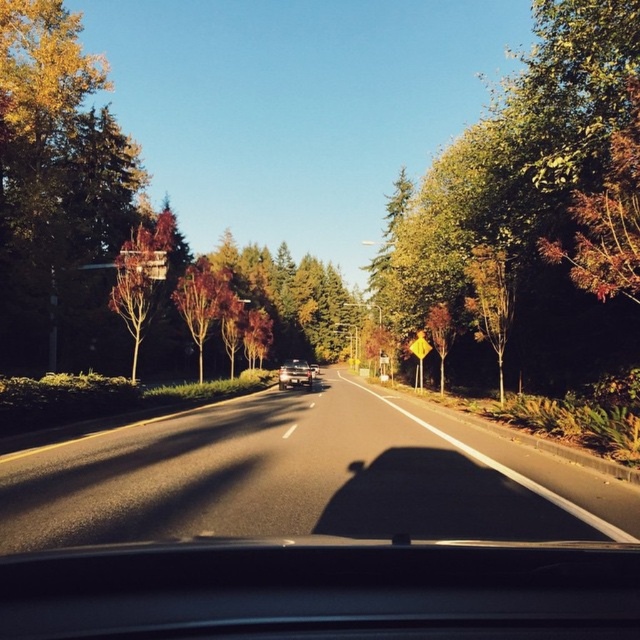
Question: Which object is the farthest from the transparent glass windshield at center?

Choices:
 (A) asphalt road at center
 (B) smooth brown tree at left
 (C) green leafy tree at right
 (D) silver metallic sedan at center

Answer: (D)

Question: Does asphalt road at center have a larger size compared to green matte tree at center-right?

Choices:
 (A) no
 (B) yes

Answer: (A)

Question: Can you confirm if transparent glass windshield at center is positioned to the right of reddish-brown bark tree at center-left?

Choices:
 (A) yes
 (B) no

Answer: (A)

Question: Does asphalt road at center have a lesser width compared to green leafy tree at right?

Choices:
 (A) no
 (B) yes

Answer: (B)

Question: Which point is farther to the camera?

Choices:
 (A) (452, 333)
 (B) (301, 504)
 (C) (289, 374)
 (D) (440, 160)

Answer: (D)

Question: Which of the following is the closest to the observer?

Choices:
 (A) (577, 260)
 (B) (166, 253)
 (C) (422, 358)
 (D) (445, 355)

Answer: (A)